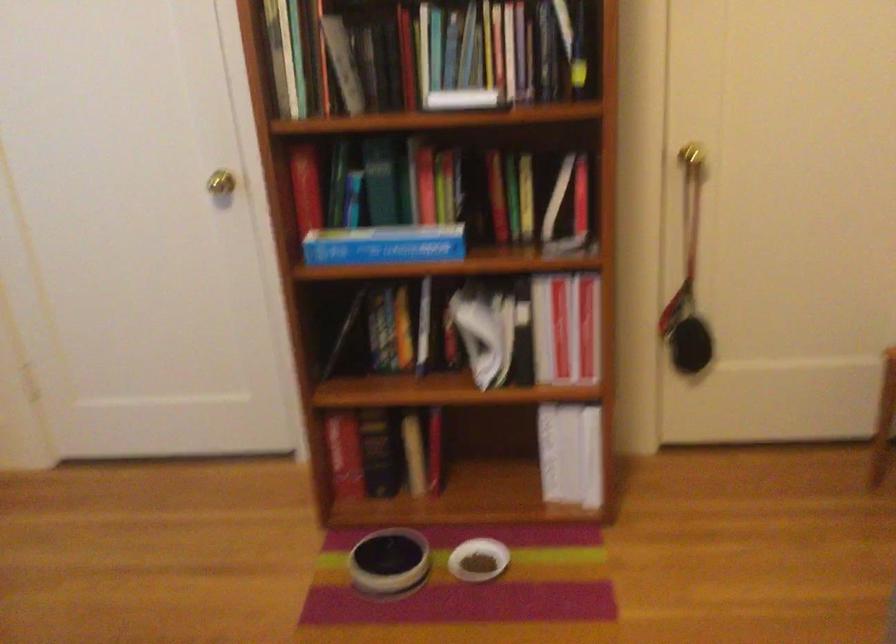
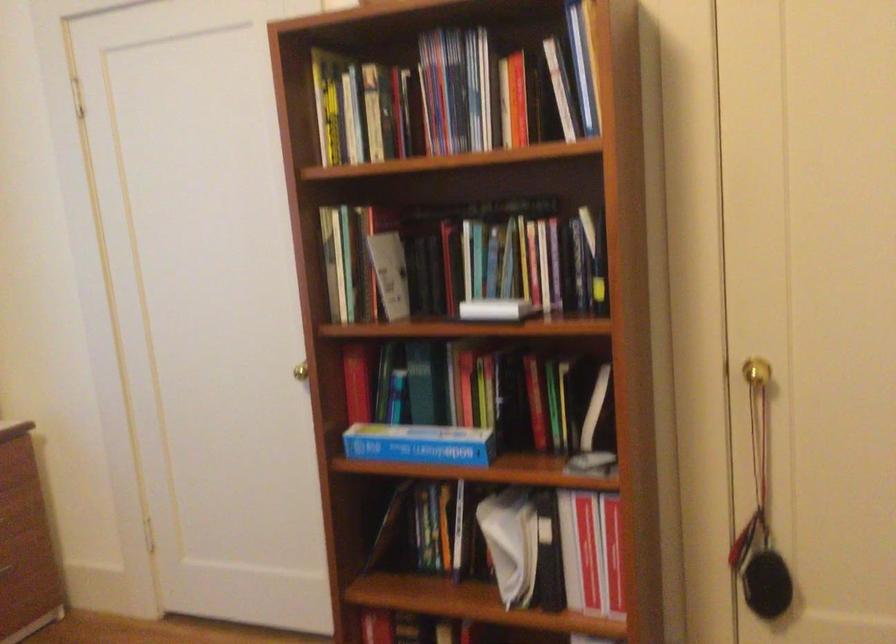
Find the pixel in the second image that matches pixel 382 333 in the first image.

(426, 527)